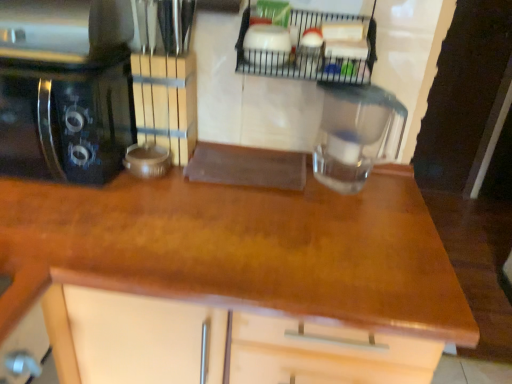
Question: Is wooden at center oriented towards black glossy coffee maker at left?

Choices:
 (A) no
 (B) yes

Answer: (A)

Question: Considering the relative sizes of wooden at center and black glossy coffee maker at left in the image provided, is wooden at center thinner than black glossy coffee maker at left?

Choices:
 (A) yes
 (B) no

Answer: (B)

Question: From the image's perspective, does wooden at center appear lower than black glossy coffee maker at left?

Choices:
 (A) yes
 (B) no

Answer: (A)

Question: Considering the relative positions of wooden at center and black glossy coffee maker at left in the image provided, is wooden at center to the left of black glossy coffee maker at left from the viewer's perspective?

Choices:
 (A) yes
 (B) no

Answer: (B)

Question: Is wooden at center completely or partially outside of black glossy coffee maker at left?

Choices:
 (A) yes
 (B) no

Answer: (A)

Question: From a real-world perspective, does wooden at center sit lower than black glossy coffee maker at left?

Choices:
 (A) yes
 (B) no

Answer: (A)

Question: From the image's perspective, is wooden at center on top of transparent glass jar at center?

Choices:
 (A) yes
 (B) no

Answer: (B)

Question: Considering the relative positions of wooden at center and transparent glass jar at center in the image provided, is wooden at center to the right of transparent glass jar at center from the viewer's perspective?

Choices:
 (A) yes
 (B) no

Answer: (B)

Question: Considering the relative positions of wooden at center and transparent glass jar at center in the image provided, is wooden at center behind transparent glass jar at center?

Choices:
 (A) no
 (B) yes

Answer: (A)

Question: Considering the relative positions of wooden at center and transparent glass jar at center in the image provided, is wooden at center in front of transparent glass jar at center?

Choices:
 (A) no
 (B) yes

Answer: (B)

Question: Would you say wooden at center contains transparent glass jar at center?

Choices:
 (A) yes
 (B) no

Answer: (B)

Question: Are wooden at center and transparent glass jar at center making contact?

Choices:
 (A) no
 (B) yes

Answer: (A)

Question: Is metallic wire rack at upper center smaller than transparent glass jar at center?

Choices:
 (A) no
 (B) yes

Answer: (B)